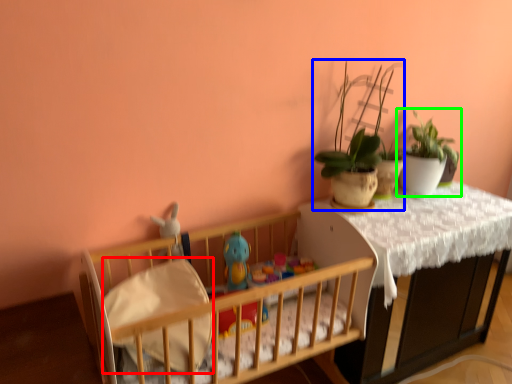
Question: Which object is the farthest from sheet (highlighted by a red box)? Choose among these: houseplant (highlighted by a blue box) or houseplant (highlighted by a green box).

Choices:
 (A) houseplant
 (B) houseplant

Answer: (B)